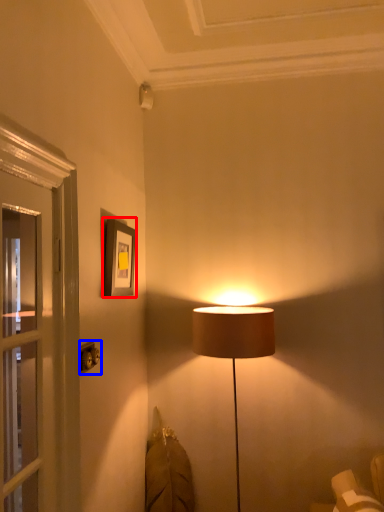
Question: Which object appears farthest to the camera in this image, picture frame (highlighted by a red box) or electric outlet (highlighted by a blue box)?

Choices:
 (A) picture frame
 (B) electric outlet

Answer: (A)